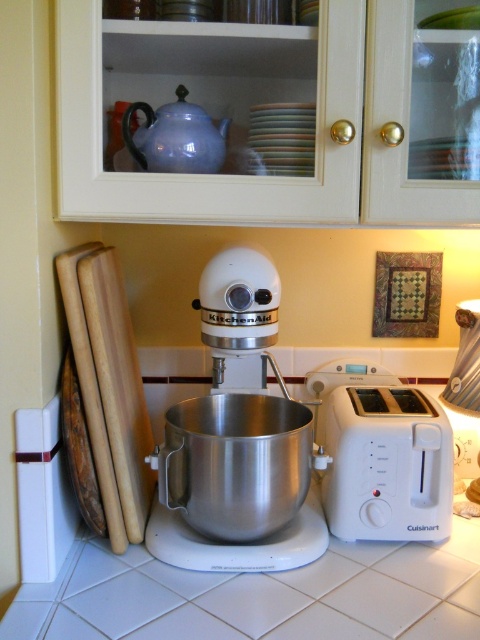
Is white matte kitchenaid mixer at center thinner than matte blue teapot at upper center?

Incorrect, white matte kitchenaid mixer at center's width is not less than matte blue teapot at upper center's.

Can you confirm if white matte kitchenaid mixer at center is positioned above matte blue teapot at upper center?

No, white matte kitchenaid mixer at center is not above matte blue teapot at upper center.

Describe the element at coordinates (237, 440) in the screenshot. I see `white matte kitchenaid mixer at center` at that location.

Find the location of a particular element. white matte kitchenaid mixer at center is located at coordinates (237, 440).

Does white matte kitchenaid mixer at center appear on the left side of white plastic toaster at right?

Indeed, white matte kitchenaid mixer at center is positioned on the left side of white plastic toaster at right.

The height and width of the screenshot is (640, 480). What do you see at coordinates (237, 440) in the screenshot?
I see `white matte kitchenaid mixer at center` at bounding box center [237, 440].

Who is more distant from viewer, (276, 365) or (421, 496)?

Positioned behind is point (276, 365).

You are a GUI agent. You are given a task and a screenshot of the screen. Output one action in this format:
    pyautogui.click(x=<x>, y=<y>)
    Task: Click on the white matte kitchenaid mixer at center
    
    Given the screenshot: What is the action you would take?
    pyautogui.click(x=237, y=440)

Does white plastic toaster at right appear on the right side of matte blue teapot at upper center?

Indeed, white plastic toaster at right is positioned on the right side of matte blue teapot at upper center.

Is white plastic toaster at right taller than matte blue teapot at upper center?

Yes.

Image resolution: width=480 pixels, height=640 pixels. What do you see at coordinates (382, 456) in the screenshot? I see `white plastic toaster at right` at bounding box center [382, 456].

You are a GUI agent. You are given a task and a screenshot of the screen. Output one action in this format:
    pyautogui.click(x=<x>, y=<y>)
    Task: Click on the white plastic toaster at right
    
    Given the screenshot: What is the action you would take?
    pyautogui.click(x=382, y=456)